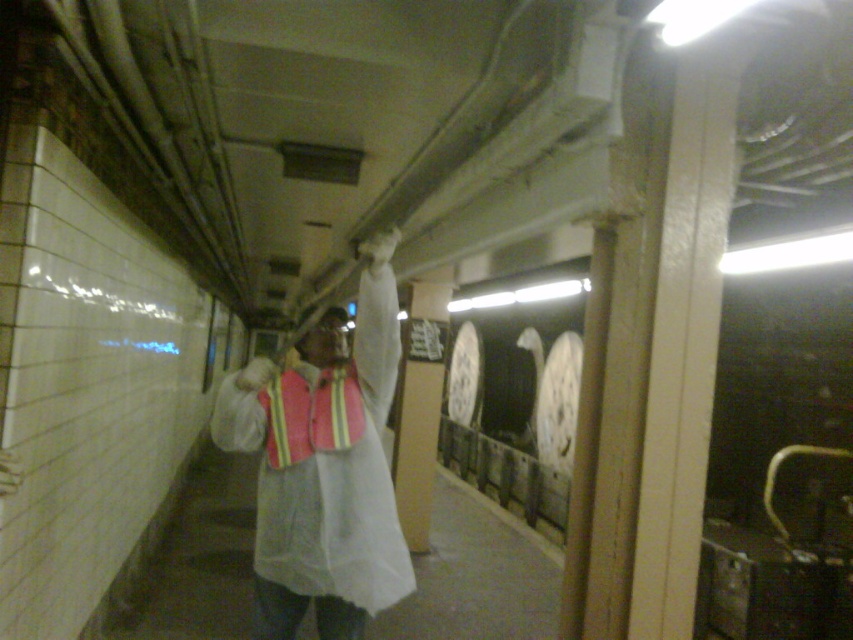
Which is more to the left, reflective safety vest at center or reflective fabric safety vest at center?

Positioned to the left is reflective fabric safety vest at center.

Is reflective safety vest at center further to camera compared to reflective fabric safety vest at center?

No, it is not.

Where is `reflective safety vest at center`? reflective safety vest at center is located at coordinates (323, 472).

Between reflective safety vest at center and matte white head at center, which one is positioned higher?

Positioned higher is matte white head at center.

Is point (345, 499) closer to camera compared to point (329, 358)?

Yes, point (345, 499) is in front of point (329, 358).

Describe the element at coordinates (323, 472) in the screenshot. The height and width of the screenshot is (640, 853). I see `reflective safety vest at center` at that location.

At what (x,y) coordinates should I click in order to perform the action: click on reflective safety vest at center. Please return your answer as a coordinate pair (x, y). The height and width of the screenshot is (640, 853). Looking at the image, I should click on (323, 472).

Looking at this image, which is more to the right, reflective fabric safety vest at center or matte white head at center?

reflective fabric safety vest at center

Can you confirm if reflective fabric safety vest at center is positioned below matte white head at center?

Yes.

Between point (279, 416) and point (346, 356), which one is positioned behind?

The point (346, 356) is behind.

At what (x,y) coordinates should I click in order to perform the action: click on reflective fabric safety vest at center. Please return your answer as a coordinate pair (x, y). Looking at the image, I should click on (310, 413).